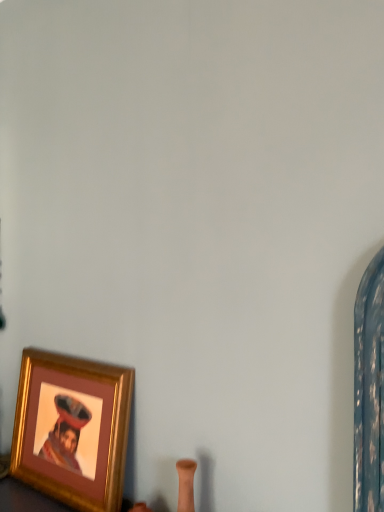
Describe the element at coordinates (99, 429) in the screenshot. Image resolution: width=384 pixels, height=512 pixels. I see `gold-framed picture at lower left` at that location.

This screenshot has width=384, height=512. Identify the location of gold-framed picture at lower left. (99, 429).

Where is `gold-framed picture at lower left`? The image size is (384, 512). gold-framed picture at lower left is located at coordinates (99, 429).